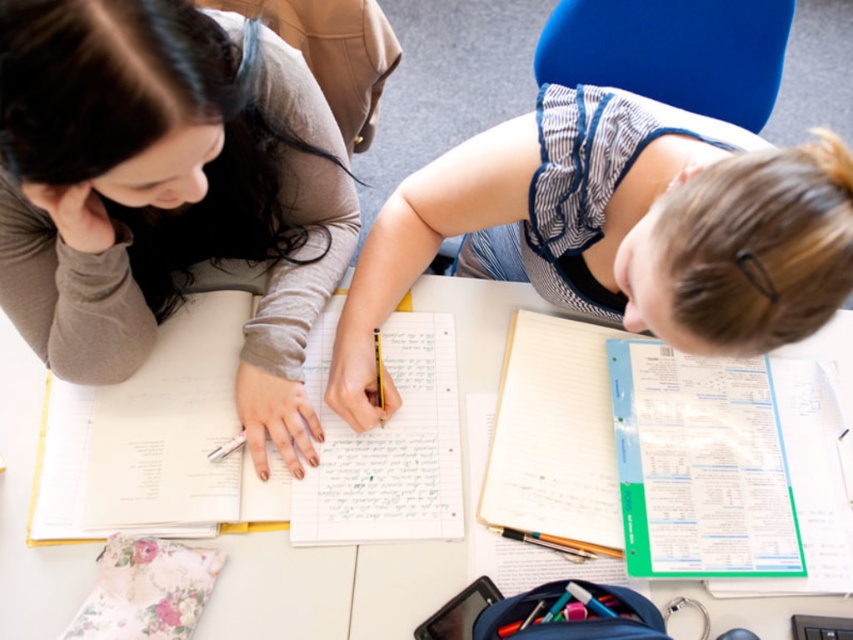
Who is more distant from viewer, (375, 620) or (427, 518)?

Positioned behind is point (427, 518).

This screenshot has width=853, height=640. In order to click on white paper at center in this screenshot , I will do `click(328, 588)`.

Identify the location of white paper at center. The image size is (853, 640). pos(328,588).

Does white paper notebook at center have a larger size compared to white lined paper at center?

Yes.

Between white paper notebook at center and white lined paper at center, which one appears on the right side from the viewer's perspective?

Positioned to the right is white paper notebook at center.

Between point (459, 216) and point (293, 534), which one is positioned behind?

Positioned behind is point (459, 216).

This screenshot has height=640, width=853. I want to click on white paper notebook at center, so click(616, 230).

Can you confirm if matte gray sweater at upper left is taller than white paper notebook at lower right?

Yes.

Is point (167, 243) positioned behind point (550, 356)?

That is False.

This screenshot has height=640, width=853. Identify the location of matte gray sweater at upper left. (165, 189).